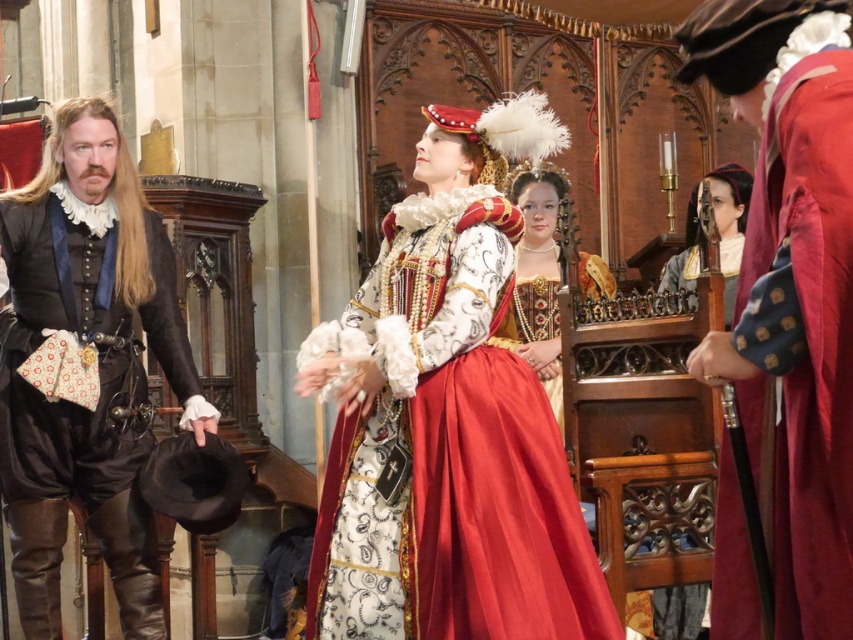
You are an actor in a play and need to adjust your costume. You are currently standing in the grand hall. Can you reach the silk lace collar at upper center from your position near the matte black vest at left without moving more than 45 feet?

The matte black vest at left is 47.05 feet away from the silk lace collar at upper center. Since you can only move 45 feet, you cannot reach the silk lace collar at upper center without moving more than that distance.

You are an assistant helping to prepare for a historical play. You need to arrange the matte black vest at left and the velvet maroon robe at right on a rack. According to the scene description, where should each be placed relative to each other?

The matte black vest at left should be placed below the velvet maroon robe at right on the rack, as the matte black vest at left is located below velvet maroon robe at right in the scene.

You are an event planner organizing a historical ball and need to place a 1.2m wide table in the grand hall. The matte white lace dress at center is currently occupying the space at point 0.658, 0.525. Can you place the table there without overlapping the dress?

The matte white lace dress at center is located at point (447, 420). Since the table is 1.2m wide, it would require more space than just the single point the dress occupies, so placing the table there would overlap the dress.